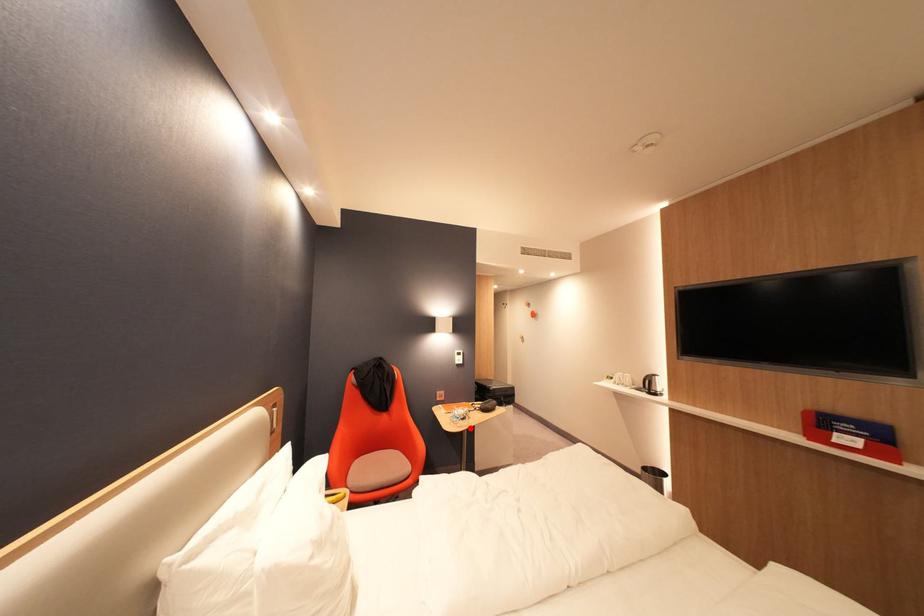
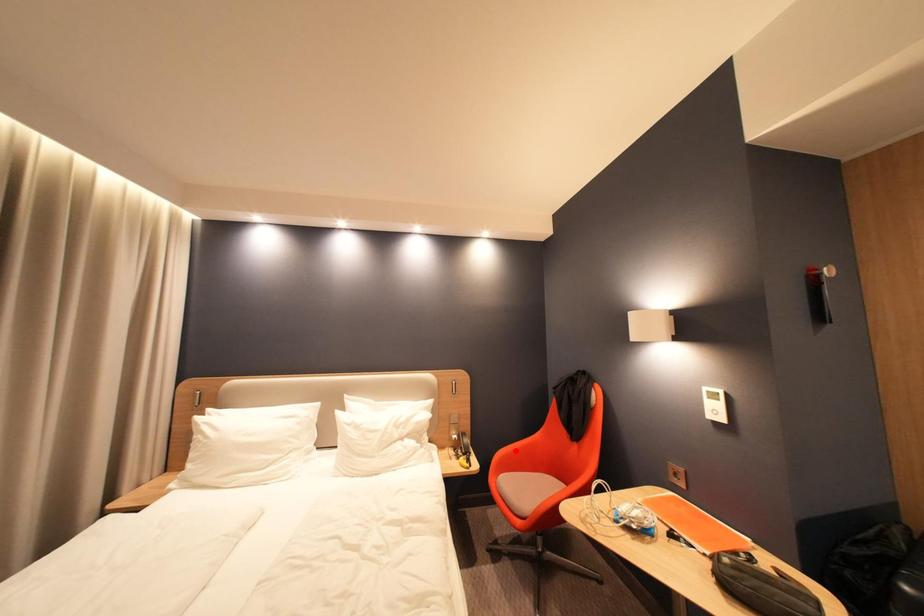
I am providing you with two images of the same scene from different viewpoints. A red point is marked on the first image and another point is marked on the second image. Is the marked point in image1 the same physical position as the marked point in image2?

No